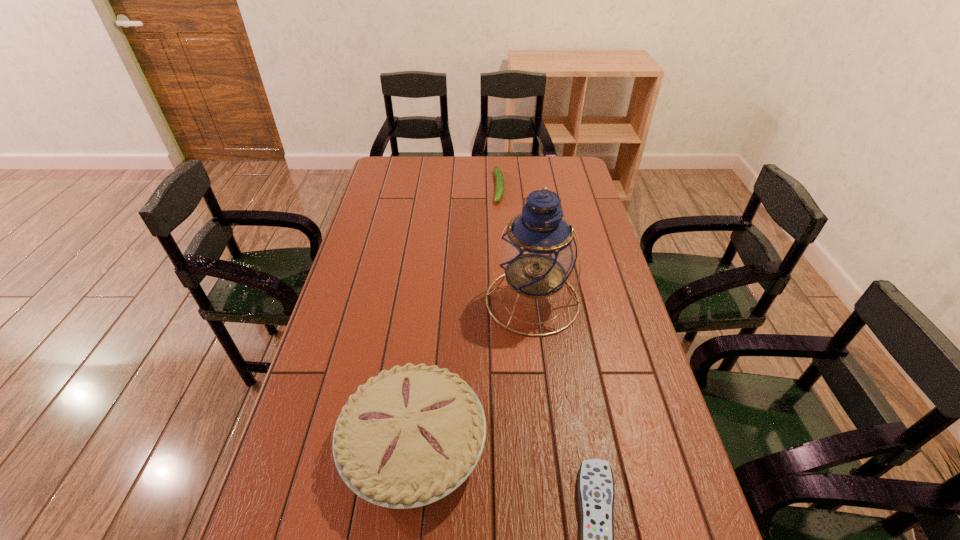
I want to click on free spot located on the front-facing side of the farthest object, so point(500,225).

Identify the location of free space located on the front-facing side of the farthest object. The width and height of the screenshot is (960, 540). (501, 245).

You are a GUI agent. You are given a task and a screenshot of the screen. Output one action in this format:
    pyautogui.click(x=<x>, y=<y>)
    Task: Click on the vacant position located on the front-facing side of the farthest object
    The height and width of the screenshot is (540, 960).
    Given the screenshot: What is the action you would take?
    pyautogui.click(x=501, y=269)

Locate an element on the screen. object that is positioned at the far edge is located at coordinates (498, 173).

Where is `object that is positioned at the near edge`? The width and height of the screenshot is (960, 540). object that is positioned at the near edge is located at coordinates (410, 436).

The height and width of the screenshot is (540, 960). Identify the location of object present at the left edge. (410, 436).

Identify the location of object that is at the right edge. tap(538, 252).

Where is `object positioned at the near left corner`? object positioned at the near left corner is located at coordinates (410, 436).

Locate an element on the screen. This screenshot has height=540, width=960. vacant space at the far edge of the desktop is located at coordinates pyautogui.click(x=467, y=161).

I want to click on vacant area at the left edge, so pos(370,320).